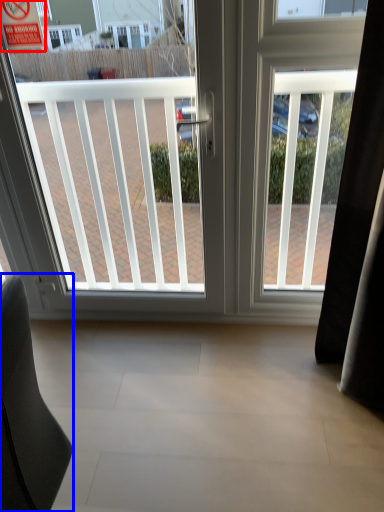
Question: Among these objects, which one is nearest to the camera, parking sign (highlighted by a red box) or furniture (highlighted by a blue box)?

Choices:
 (A) parking sign
 (B) furniture

Answer: (B)